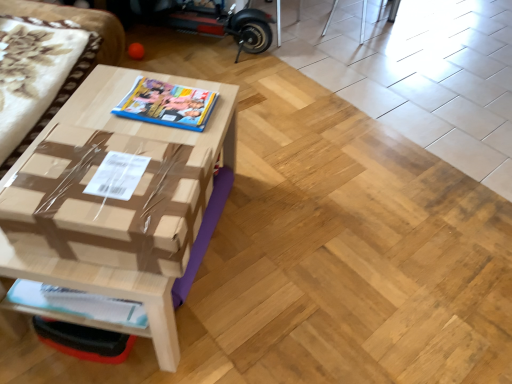
Identify the location of vacant area that lies to the right of brown cardboard table at center. Image resolution: width=512 pixels, height=384 pixels. pos(303,253).